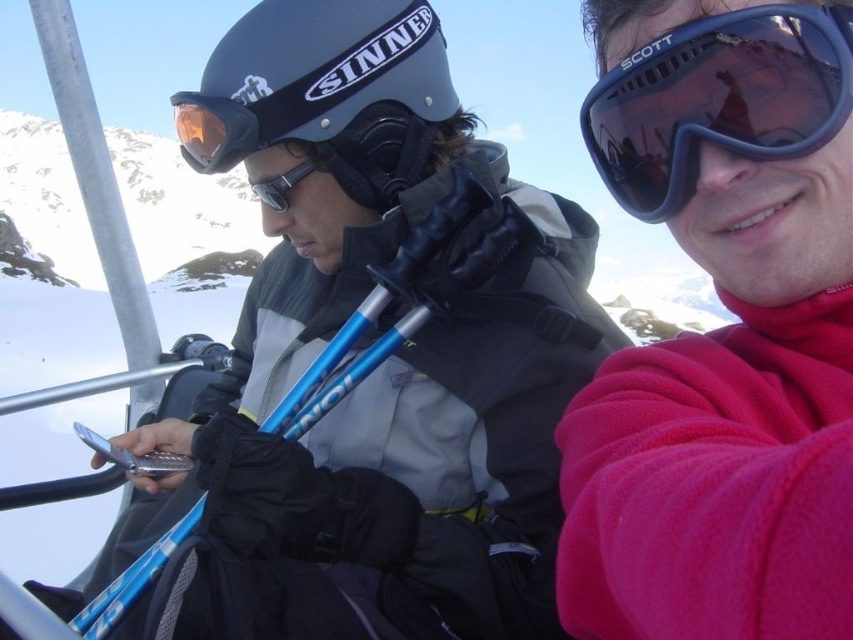
Question: Which object is the closest to the pink fleece jacket at upper right?

Choices:
 (A) blue metallic ski pole at left
 (B) matte black helmet at center

Answer: (A)

Question: Which object appears farthest from the camera in this image?

Choices:
 (A) matte black helmet at center
 (B) pink fleece jacket at upper right
 (C) dark blue plastic goggles at upper right
 (D) blue metallic ski pole at left

Answer: (A)

Question: Does dark blue plastic goggles at upper right have a larger size compared to blue metallic ski pole at left?

Choices:
 (A) no
 (B) yes

Answer: (A)

Question: Can you confirm if pink fleece jacket at upper right is positioned to the right of dark blue plastic goggles at upper right?

Choices:
 (A) no
 (B) yes

Answer: (B)

Question: Among these objects, which one is farthest from the camera?

Choices:
 (A) dark blue plastic goggles at upper right
 (B) blue metallic ski pole at left
 (C) pink fleece jacket at upper right

Answer: (B)

Question: Is dark blue plastic goggles at upper right smaller than blue metallic ski pole at left?

Choices:
 (A) yes
 (B) no

Answer: (A)